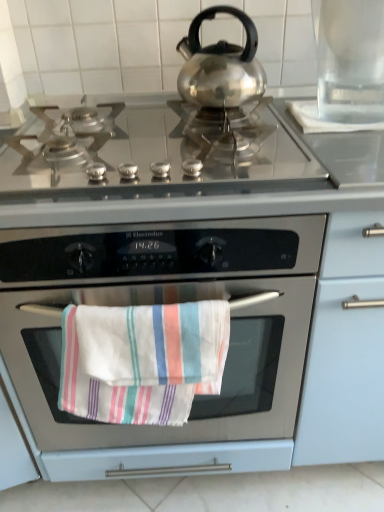
Find the location of `stainless steel oven at center`. stainless steel oven at center is located at coordinates (167, 303).

I want to click on white striped towel at center, so click(x=142, y=360).

Image resolution: width=384 pixels, height=512 pixels. I want to click on stainless steel oven at center, so click(167, 303).

In terms of height, does transparent glass pitcher at upper right look taller or shorter compared to stainless steel oven at center?

transparent glass pitcher at upper right is shorter than stainless steel oven at center.

Based on their positions, is transparent glass pitcher at upper right located to the left or right of stainless steel oven at center?

In the image, transparent glass pitcher at upper right appears on the right side of stainless steel oven at center.

From the image's perspective, is transparent glass pitcher at upper right above or below stainless steel oven at center?

Based on their image positions, transparent glass pitcher at upper right is located above stainless steel oven at center.

Find the location of a particular element. oven that is under the transparent glass pitcher at upper right (from a real-world perspective) is located at coordinates (167, 303).

Could you tell me if stainless steel oven at center is turned towards white striped towel at center?

Yes, stainless steel oven at center is facing white striped towel at center.

Does stainless steel oven at center lie in front of white striped towel at center?

Yes, it is in front of white striped towel at center.

From the image's perspective, is stainless steel oven at center located above white striped towel at center?

Yes, from the image's perspective, stainless steel oven at center is on top of white striped towel at center.

From a real-world perspective, does stainless steel oven at center stand above white striped towel at center?

No, from a real-world perspective, stainless steel oven at center is not over white striped towel at center

Between transparent glass pitcher at upper right and stainless steel cooktop at center, which one has less height?

Standing shorter between the two is stainless steel cooktop at center.

Can you confirm if transparent glass pitcher at upper right is positioned to the left of stainless steel cooktop at center?

Incorrect, transparent glass pitcher at upper right is not on the left side of stainless steel cooktop at center.

From a real-world perspective, is transparent glass pitcher at upper right under stainless steel cooktop at center?

No, from a real-world perspective, transparent glass pitcher at upper right is not beneath stainless steel cooktop at center.

Is transparent glass pitcher at upper right wider or thinner than stainless steel cooktop at center?

Clearly, transparent glass pitcher at upper right has less width compared to stainless steel cooktop at center.

I want to click on beach towel in front of the transparent glass pitcher at upper right, so click(x=142, y=360).

Is white striped towel at center oriented away from transparent glass pitcher at upper right?

white striped towel at center does not have its back to transparent glass pitcher at upper right.

What's the angular difference between white striped towel at center and transparent glass pitcher at upper right's facing directions?

white striped towel at center and transparent glass pitcher at upper right are facing 93.8 degrees away from each other.

I want to click on appliance located above the stainless steel cooktop at center (from the image's perspective), so click(350, 59).

From the picture: From a real-world perspective, is stainless steel cooktop at center over transparent glass pitcher at upper right?

No, from a real-world perspective, stainless steel cooktop at center is not above transparent glass pitcher at upper right.

Looking at this image, from the image's perspective, is stainless steel cooktop at center positioned above or below transparent glass pitcher at upper right?

From the image's perspective, stainless steel cooktop at center appears below transparent glass pitcher at upper right.

Would you say transparent glass pitcher at upper right is part of stainless steel cooktop at center's contents?

No, stainless steel cooktop at center does not contain transparent glass pitcher at upper right.

Could you tell me if stainless steel oven at center is facing stainless steel cooktop at center?

No, stainless steel oven at center is not aimed at stainless steel cooktop at center.

Considering the relative positions of stainless steel oven at center and stainless steel cooktop at center in the image provided, is stainless steel oven at center in front of stainless steel cooktop at center?

Yes.

Do you think stainless steel oven at center is within stainless steel cooktop at center, or outside of it?

The correct answer is: outside.

Considering the positions of points (350, 19) and (60, 401), is point (350, 19) farther from camera compared to point (60, 401)?

No, it is in front of (60, 401).

Is transparent glass pitcher at upper right shorter than white striped towel at center?

Indeed, transparent glass pitcher at upper right has a lesser height compared to white striped towel at center.

Which is more to the left, transparent glass pitcher at upper right or white striped towel at center?

white striped towel at center.

Is transparent glass pitcher at upper right located outside white striped towel at center?

transparent glass pitcher at upper right is positioned outside white striped towel at center.

Where is `oven located underneath the transparent glass pitcher at upper right (from a real-world perspective)`? oven located underneath the transparent glass pitcher at upper right (from a real-world perspective) is located at coordinates tap(167, 303).

Find the location of `oven that appears in front of the white striped towel at center`. oven that appears in front of the white striped towel at center is located at coordinates (167, 303).

When comparing their distances from transparent glass pitcher at upper right, does white striped towel at center or stainless steel cooktop at center seem further?

white striped towel at center is positioned further to the anchor transparent glass pitcher at upper right.

Considering their positions, is transparent glass pitcher at upper right positioned further to stainless steel oven at center than stainless steel cooktop at center?

The object further to stainless steel oven at center is transparent glass pitcher at upper right.

Consider the image. Estimate the real-world distances between objects in this image. Which object is closer to white striped towel at center, stainless steel cooktop at center or transparent glass pitcher at upper right?

stainless steel cooktop at center lies closer to white striped towel at center than the other object.

From the picture: Considering their positions, is stainless steel oven at center positioned closer to stainless steel cooktop at center than transparent glass pitcher at upper right?

stainless steel oven at center.

Which object lies further to the anchor point stainless steel oven at center, white striped towel at center or stainless steel cooktop at center?

The object further to stainless steel oven at center is stainless steel cooktop at center.

From the image, which object appears to be nearer to stainless steel oven at center, white striped towel at center or transparent glass pitcher at upper right?

white striped towel at center is positioned closer to the anchor stainless steel oven at center.

Based on their spatial positions, is stainless steel cooktop at center or transparent glass pitcher at upper right further from stainless steel oven at center?

transparent glass pitcher at upper right.

When comparing their distances from white striped towel at center, does stainless steel oven at center or transparent glass pitcher at upper right seem closer?

stainless steel oven at center is closer to white striped towel at center.

This screenshot has width=384, height=512. Identify the location of gas stove between transparent glass pitcher at upper right and white striped towel at center vertically. (152, 149).

This screenshot has height=512, width=384. What are the coordinates of `gas stove between transparent glass pitcher at upper right and stainless steel oven at center from top to bottom` in the screenshot? It's located at (152, 149).

Where is `oven between transparent glass pitcher at upper right and white striped towel at center in the up-down direction`? The image size is (384, 512). oven between transparent glass pitcher at upper right and white striped towel at center in the up-down direction is located at coordinates (167, 303).

Locate an element on the screen. This screenshot has height=512, width=384. oven between stainless steel cooktop at center and white striped towel at center in the vertical direction is located at coordinates (167, 303).